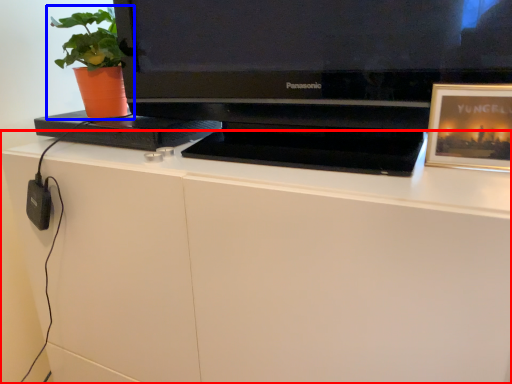
Question: Which point is closer to the camera, desk (highlighted by a red box) or houseplant (highlighted by a blue box)?

Choices:
 (A) desk
 (B) houseplant

Answer: (A)